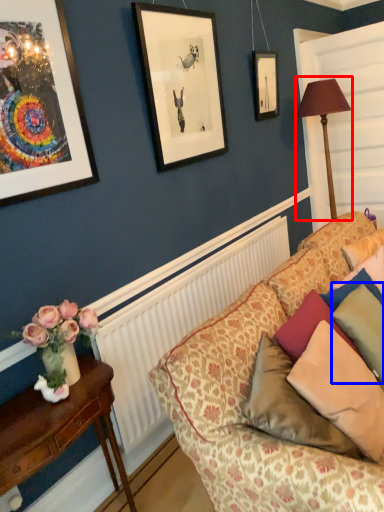
Question: Which point is further to the camera, table lamp (highlighted by a red box) or pillow (highlighted by a blue box)?

Choices:
 (A) table lamp
 (B) pillow

Answer: (A)